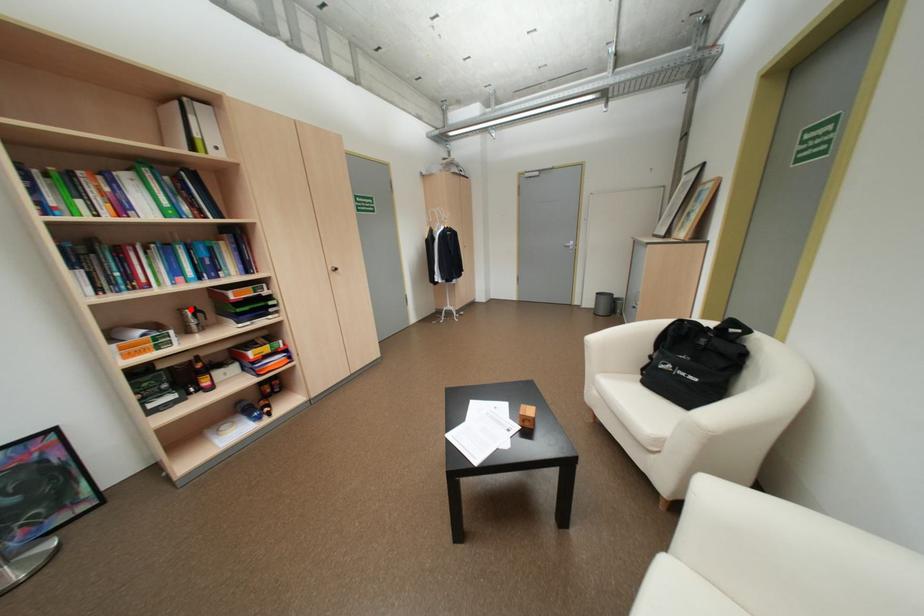
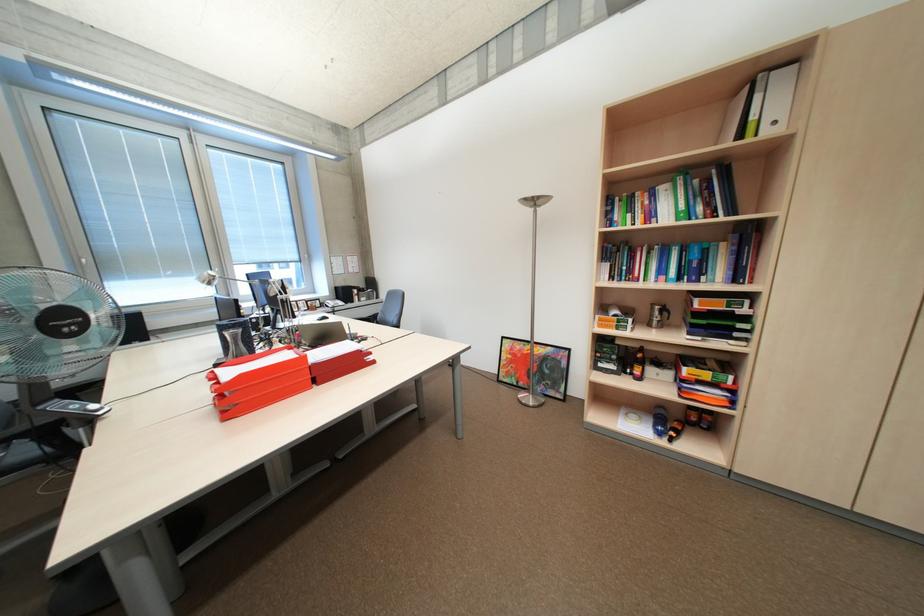
Find the pixel in the second image that matches the highlighted location in the first image.

(663, 304)